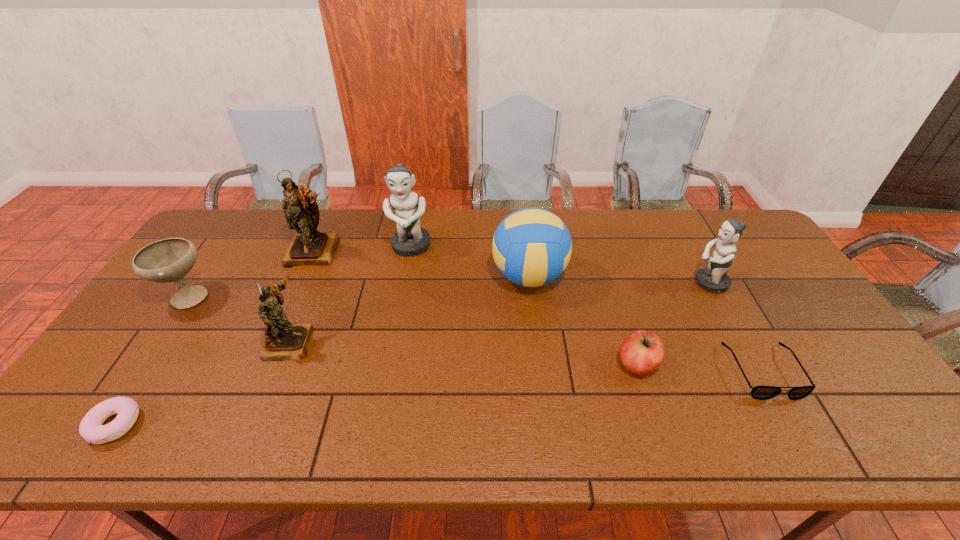
Where is `the third object from right to left`? The image size is (960, 540). the third object from right to left is located at coordinates (642, 352).

The height and width of the screenshot is (540, 960). What are the coordinates of `the third shortest object` in the screenshot? It's located at (642, 352).

Identify the location of spectacles. (758, 392).

The width and height of the screenshot is (960, 540). What are the coordinates of `black spectacles` in the screenshot? It's located at click(x=758, y=392).

This screenshot has height=540, width=960. I want to click on the shortest object, so click(91, 428).

This screenshot has width=960, height=540. I want to click on pink doughnut, so click(x=91, y=428).

Locate an element on the screen. The width and height of the screenshot is (960, 540). free region located 0.220m on the front-facing side of the farther green figurine is located at coordinates (399, 312).

What are the coordinates of `free region located 0.110m on the front-facing side of the farther gold figurine` in the screenshot? It's located at (297, 293).

Find the location of `vacant area located 0.210m on the right of the volleyball`. vacant area located 0.210m on the right of the volleyball is located at coordinates (634, 276).

You are a GUI agent. You are given a task and a screenshot of the screen. Output one action in this format:
    pyautogui.click(x=<x>, y=<y>)
    Task: Click on the vacant space located on the front-facing side of the nearer gold figurine
    Image resolution: width=960 pixels, height=540 pixels.
    Given the screenshot: What is the action you would take?
    point(401,341)